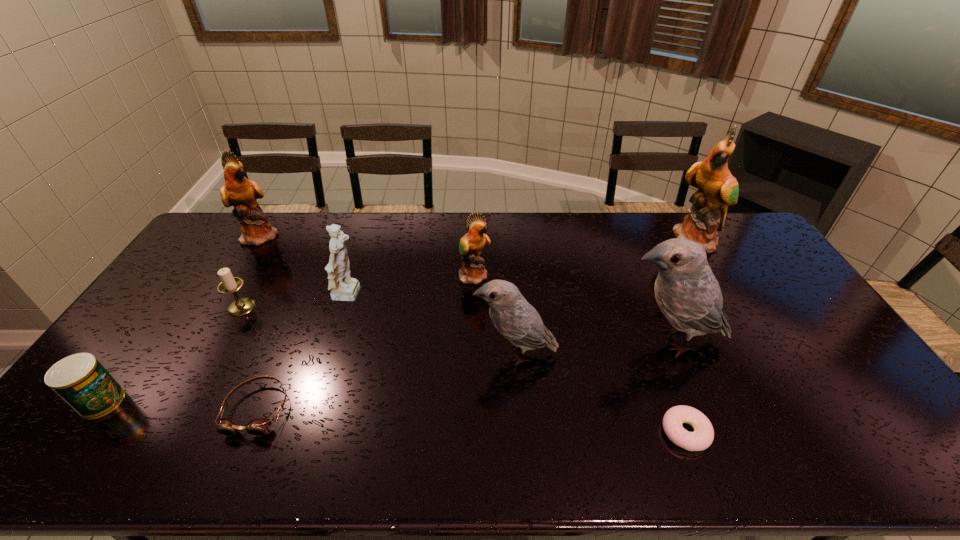
The image size is (960, 540). Find the location of `the tallest object`. the tallest object is located at coordinates (717, 188).

The image size is (960, 540). Identify the location of the rightmost green parrot. (717, 188).

Where is `the second smallest green parrot`? This screenshot has height=540, width=960. the second smallest green parrot is located at coordinates pyautogui.click(x=238, y=191).

This screenshot has height=540, width=960. What are the coordinates of `the leftmost parrot` in the screenshot? It's located at (238, 191).

The height and width of the screenshot is (540, 960). I want to click on the right gray parrot, so click(687, 292).

Locate an element on the screen. This screenshot has width=960, height=540. the fifth object from left to right is located at coordinates (343, 288).

This screenshot has height=540, width=960. In order to click on the nearest green parrot in this screenshot , I will do `click(473, 271)`.

This screenshot has height=540, width=960. In order to click on the smallest green parrot in this screenshot , I will do `click(473, 271)`.

You are a GUI agent. You are given a task and a screenshot of the screen. Output one action in this format:
    pyautogui.click(x=<x>, y=<y>)
    Task: Click on the left gray parrot
    
    Given the screenshot: What is the action you would take?
    pyautogui.click(x=518, y=321)

What are the coordinates of `candle holder` in the screenshot? It's located at (229, 284).